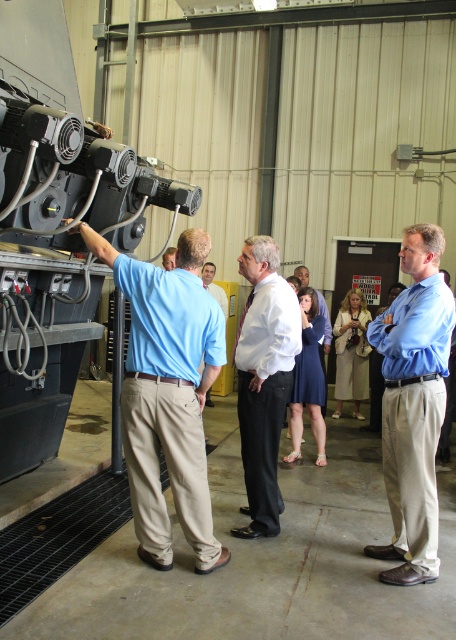
You are a visitor in the industrial facility and need to locate the person wearing the light blue shirt at center. According to the scene description, where exactly is this individual positioned?

The light blue shirt at center is located at point (414,404).